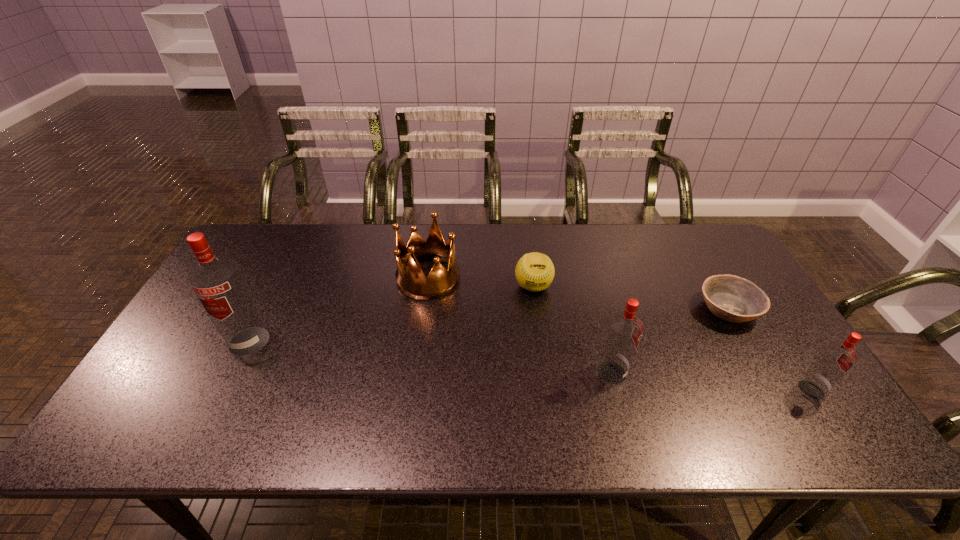
At what (x,y) coordinates should I click in order to perform the action: click on vacant space located 0.240m on the front label of the second tallest object. Please return your answer as a coordinate pair (x, y). Looking at the image, I should click on (722, 373).

You are a GUI agent. You are given a task and a screenshot of the screen. Output one action in this format:
    pyautogui.click(x=<x>, y=<y>)
    Task: Click on the vacant space located on the front of the shortest object
    The image size is (960, 540).
    Given the screenshot: What is the action you would take?
    pyautogui.click(x=765, y=374)

Identify the location of free location located on the left of the crown. This screenshot has width=960, height=540. (294, 278).

Identify the location of vacant space situated on the logo side of the softball. Image resolution: width=960 pixels, height=540 pixels. (544, 369).

In order to click on object situated at the far edge in this screenshot , I will do `click(412, 282)`.

You are a GUI agent. You are given a task and a screenshot of the screen. Output one action in this format:
    pyautogui.click(x=<x>, y=<y>)
    Task: Click on the object positioned at the left edge
    
    Given the screenshot: What is the action you would take?
    pyautogui.click(x=217, y=281)

This screenshot has width=960, height=540. Identify the location of vodka positioned at the right edge. point(836,359).

Find the location of a particular element. bowl that is at the right edge is located at coordinates (731, 298).

I want to click on object situated at the near right corner, so click(x=836, y=359).

Find the location of a particular element. free location at the far edge is located at coordinates (355, 255).